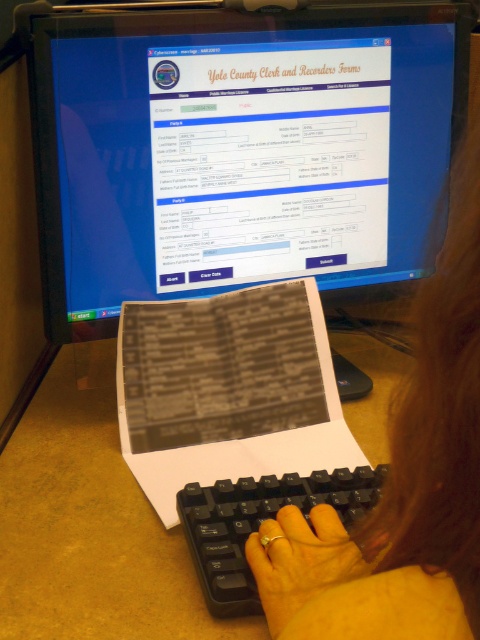
Is matte black monitor at upper center positioned at the back of yellow matte paper at center?

Yes.

Measure the distance between point (48, 259) and camera.

Point (48, 259) is 32.59 inches away from camera.

The image size is (480, 640). What do you see at coordinates (240, 148) in the screenshot?
I see `matte black monitor at upper center` at bounding box center [240, 148].

Image resolution: width=480 pixels, height=640 pixels. Identify the location of matte black monitor at upper center. (240, 148).

Who is taller, yellow matte paper at center or gold metallic ring at center?

yellow matte paper at center is taller.

Is point (73, 362) closer to camera compared to point (274, 573)?

No.

Identify the location of yellow matte paper at center. (91, 525).

Is point (48, 202) closer to camera compared to point (337, 580)?

No, (48, 202) is further to viewer.

Between matte black monitor at upper center and gold metallic ring at center, which one is positioned lower?

gold metallic ring at center is below.

Who is more distant from viewer, (242, 61) or (336, 560)?

The point (242, 61) is more distant.

This screenshot has width=480, height=640. In order to click on matte black monitor at upper center in this screenshot , I will do `click(240, 148)`.